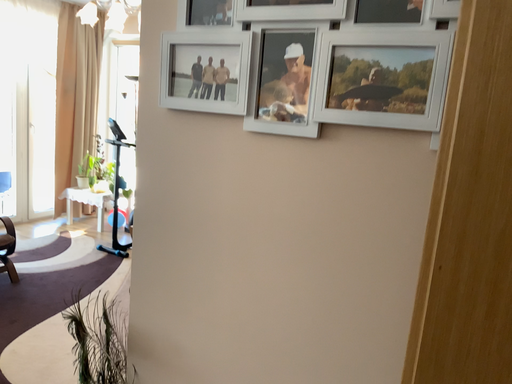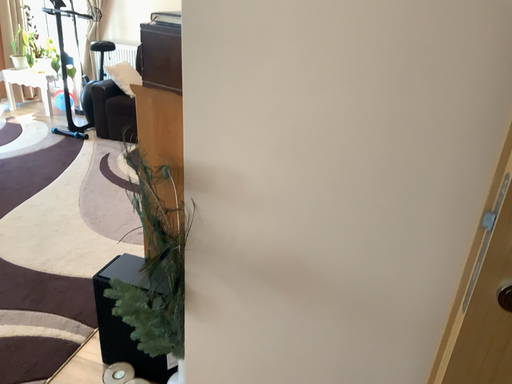
Question: Which way did the camera rotate in the video?

Choices:
 (A) rotated downward
 (B) rotated upward

Answer: (A)